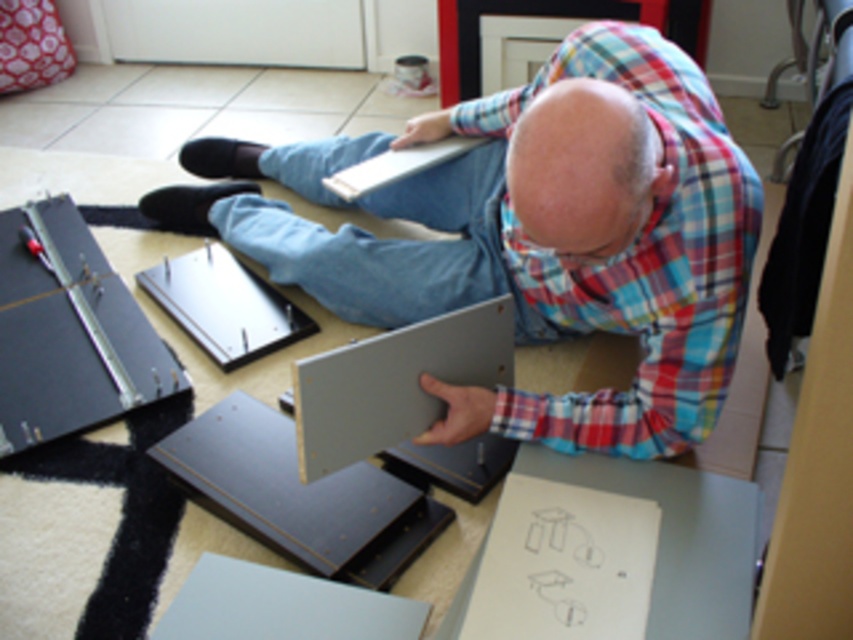
Is matte gray panel at center taller than white matte laptop at center?

Correct, matte gray panel at center is much taller as white matte laptop at center.

Locate an element on the screen. matte gray panel at center is located at coordinates (535, 234).

This screenshot has height=640, width=853. Describe the element at coordinates (535, 234) in the screenshot. I see `matte gray panel at center` at that location.

Find the location of a particular element. matte gray panel at center is located at coordinates (535, 234).

Is metallic silver bracket at lower left bigger than white matte laptop at center?

Yes.

Is metallic silver bracket at lower left below white matte laptop at center?

Correct, metallic silver bracket at lower left is located below white matte laptop at center.

Measure the distance between point (108, 419) and camera.

Point (108, 419) is 6.08 feet from camera.

Find the location of `metallic silver bracket at lower left`. metallic silver bracket at lower left is located at coordinates point(68,332).

Can you confirm if matte gray panel at center is wider than metallic silver bracket at lower left?

Yes, matte gray panel at center is wider than metallic silver bracket at lower left.

Is matte gray panel at center smaller than metallic silver bracket at lower left?

Incorrect, matte gray panel at center is not smaller in size than metallic silver bracket at lower left.

Locate an element on the screen. matte gray panel at center is located at coordinates (535, 234).